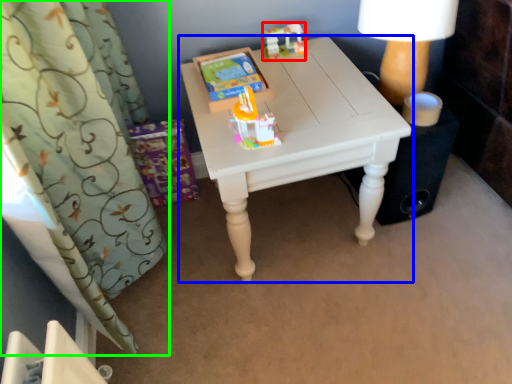
Question: Which is nearer to the toy (highlighted by a red box)? table (highlighted by a blue box) or curtain (highlighted by a green box).

Choices:
 (A) table
 (B) curtain

Answer: (A)